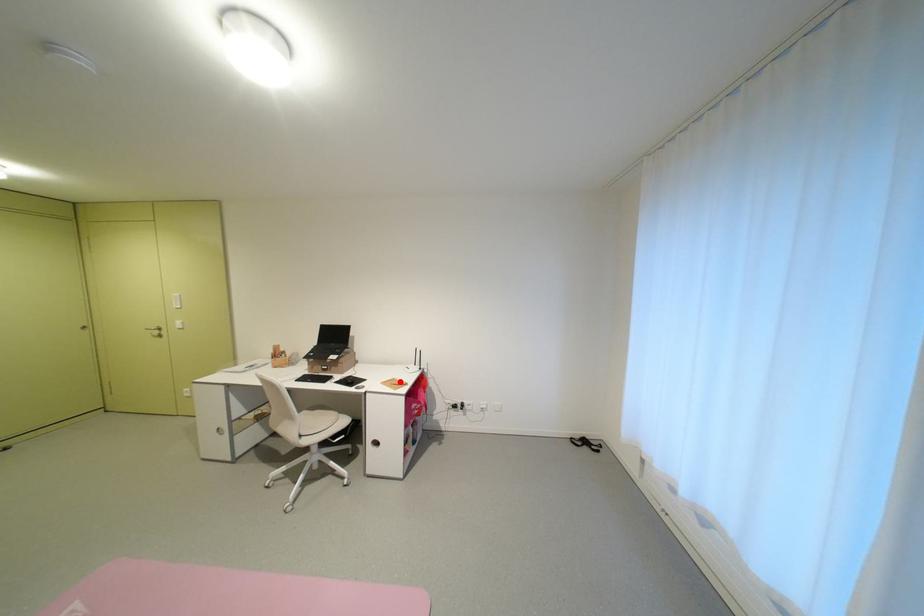
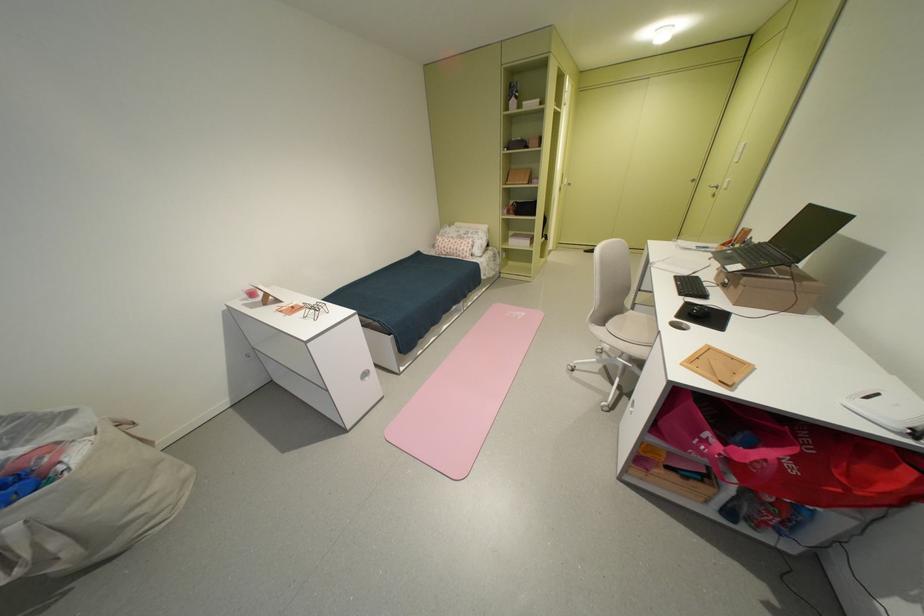
Question: I am providing you with two images of the same scene from different viewpoints. A red point is marked on the first image. At the location where the point appears in image 1, is it still visible in image 2?

Choices:
 (A) Yes
 (B) No

Answer: (A)